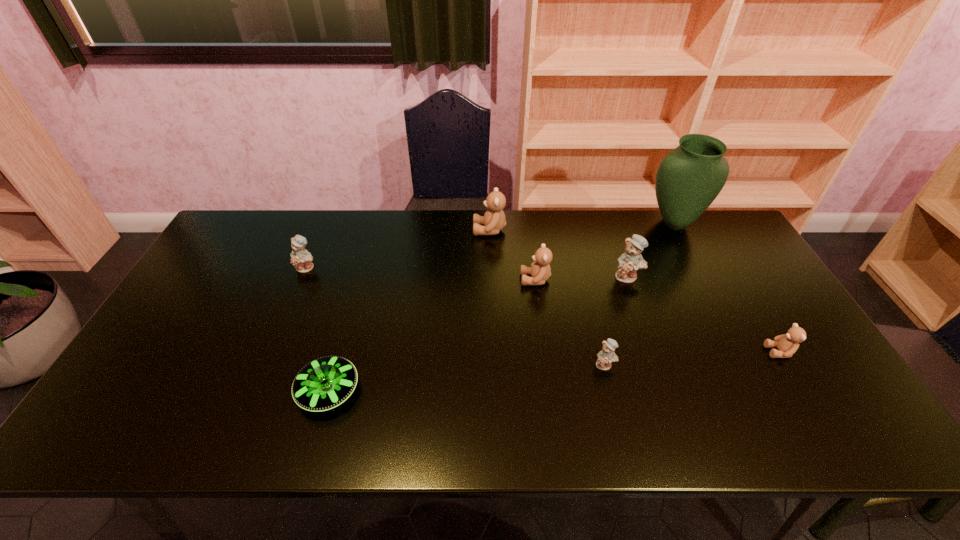
Locate an element on the screen. This screenshot has width=960, height=540. vase located at the far edge is located at coordinates (689, 178).

In order to click on teddy bear present at the far edge in this screenshot , I will do `click(494, 220)`.

Find the location of `object present at the near edge`. object present at the near edge is located at coordinates (325, 383).

At what (x,y) coordinates should I click in order to perform the action: click on vase that is positioned at the right edge. Please return your answer as a coordinate pair (x, y). This screenshot has width=960, height=540. Looking at the image, I should click on (689, 178).

Identify the location of teddy bear located in the right edge section of the desktop. (787, 344).

Find the location of a particular element. The height and width of the screenshot is (540, 960). object that is at the far right corner is located at coordinates (689, 178).

The height and width of the screenshot is (540, 960). Find the location of `blank space at the far edge of the desktop`. blank space at the far edge of the desktop is located at coordinates (541, 225).

Where is `vacant space at the near edge`? vacant space at the near edge is located at coordinates (739, 433).

Image resolution: width=960 pixels, height=540 pixels. I want to click on vacant space at the left edge, so click(207, 288).

I want to click on free region at the right edge of the desktop, so 772,320.